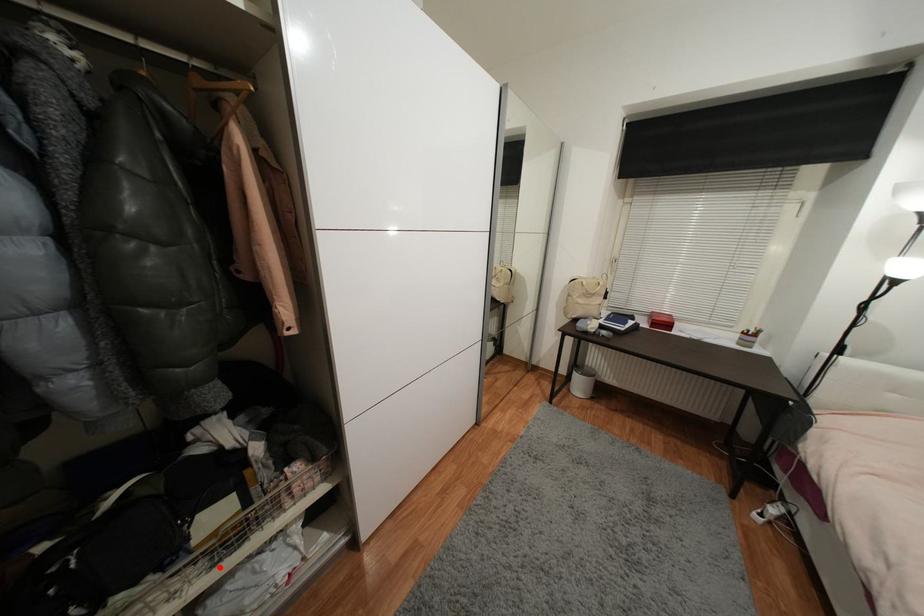
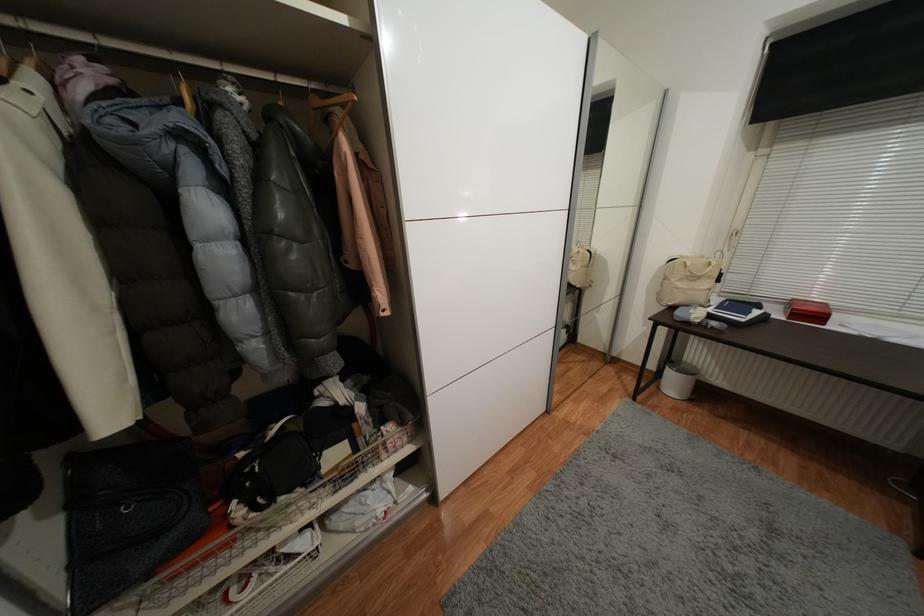
Locate, in the second image, the point that corresponds to the highlighted location in the first image.

(342, 493)